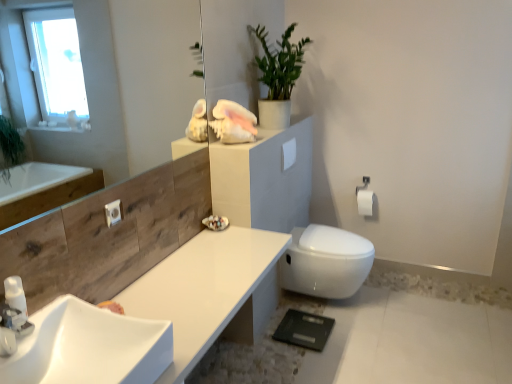
What is the approximate width of white glossy sink at lower left?

white glossy sink at lower left is 16.30 inches in width.

Image resolution: width=512 pixels, height=384 pixels. What do you see at coordinates (89, 347) in the screenshot?
I see `white glossy sink at lower left` at bounding box center [89, 347].

The image size is (512, 384). Find the location of `white matte toilet paper at upper right, which is the second toilet paper from back to front`. white matte toilet paper at upper right, which is the second toilet paper from back to front is located at coordinates (289, 153).

Considering the relative sizes of white glossy bidet at lower right and transparent glass mirror at upper left in the image provided, is white glossy bidet at lower right smaller than transparent glass mirror at upper left?

Incorrect, white glossy bidet at lower right is not smaller in size than transparent glass mirror at upper left.

Between point (320, 244) and point (169, 57), which one is positioned behind?

The point (169, 57) is behind.

Which object is positioned more to the right, white glossy bidet at lower right or transparent glass mirror at upper left?

Positioned to the right is white glossy bidet at lower right.

Between white glossy bidet at lower right and transparent glass mirror at upper left, which one has less height?

white glossy bidet at lower right is shorter.

Between white glossy soap dispenser at lower left and white glossy sink at lower left, which one has smaller width?

white glossy soap dispenser at lower left.

From the image's perspective, which is above, white glossy soap dispenser at lower left or white glossy sink at lower left?

white glossy soap dispenser at lower left, from the image's perspective.

Is white glossy soap dispenser at lower left not near white glossy sink at lower left?

That's not correct — white glossy soap dispenser at lower left is a little close to white glossy sink at lower left.

Is white glossy soap dispenser at lower left to the left of white glossy sink at lower left from the viewer's perspective?

Yes, white glossy soap dispenser at lower left is to the left of white glossy sink at lower left.

From a real-world perspective, who is located lower, green matte plant at upper center or white glossy sink at lower left?

white glossy sink at lower left, from a real-world perspective.

Can you confirm if green matte plant at upper center is smaller than white glossy sink at lower left?

No, green matte plant at upper center is not smaller than white glossy sink at lower left.

Is white glossy sink at lower left at the back of green matte plant at upper center?

No, white glossy sink at lower left is not at the back of green matte plant at upper center.

Can white glossy sink at lower left be found inside green matte plant at upper center?

No, white glossy sink at lower left is not surrounded by green matte plant at upper center.

From a real-world perspective, who is located lower, white glossy counter top at center or white glossy tap at lower left?

white glossy counter top at center.

Is white glossy counter top at center placed right next to white glossy tap at lower left?

No, white glossy counter top at center is not making contact with white glossy tap at lower left.

Considering the sizes of objects white glossy counter top at center and white glossy tap at lower left in the image provided, who is wider, white glossy counter top at center or white glossy tap at lower left?

Wider between the two is white glossy counter top at center.

From the image's perspective, who appears lower, white glossy counter top at center or white glossy tap at lower left?

white glossy counter top at center is shown below in the image.

Is white matte toilet paper at right, which is the 2th toilet paper from front to back, completely or partially outside of white glossy soap dispenser at lower left?

Yes.

Between white matte toilet paper at right, marked as the 1th toilet paper in a right-to-left arrangement, and white glossy soap dispenser at lower left, which one has smaller width?

Thinner between the two is white glossy soap dispenser at lower left.

From the image's perspective, between white matte toilet paper at right, marked as the 1th toilet paper in a right-to-left arrangement, and white glossy soap dispenser at lower left, which one is located above?

From the image's view, white matte toilet paper at right, marked as the 1th toilet paper in a right-to-left arrangement, is above.

Is white glossy tap at lower left at the back of white glossy soap dispenser at lower left?

white glossy soap dispenser at lower left does not have its back to white glossy tap at lower left.

Which is nearer, [21,299] or [19,320]?

The point [19,320] is closer.

Is there a large distance between white glossy soap dispenser at lower left and white glossy tap at lower left?

They are positioned close to each other.

Considering the sizes of white glossy soap dispenser at lower left and white glossy tap at lower left in the image, is white glossy soap dispenser at lower left bigger or smaller than white glossy tap at lower left?

In the image, white glossy soap dispenser at lower left appears to be smaller than white glossy tap at lower left.

Is white glossy sink at lower left surrounded by transparent glass mirror at upper left?

That's incorrect, white glossy sink at lower left is not inside transparent glass mirror at upper left.

Which object is further away from the camera taking this photo, transparent glass mirror at upper left or white glossy sink at lower left?

transparent glass mirror at upper left is further away from the camera.

Is transparent glass mirror at upper left to the left of white glossy sink at lower left from the viewer's perspective?

Incorrect, transparent glass mirror at upper left is not on the left side of white glossy sink at lower left.

Is transparent glass mirror at upper left oriented towards white glossy sink at lower left?

No, transparent glass mirror at upper left is not turned towards white glossy sink at lower left.

At what (x,y) coordinates should I click in order to perform the action: click on mirror that appears in front of the white glossy bidet at lower right. Please return your answer as a coordinate pair (x, y). The height and width of the screenshot is (384, 512). Looking at the image, I should click on (116, 84).

The height and width of the screenshot is (384, 512). In order to click on soap dispenser above the white glossy sink at lower left (from the image's perspective) in this screenshot , I will do `click(15, 294)`.

Based on their spatial positions, is white glossy soap dispenser at lower left or white matte toilet paper at right, the second toilet paper positioned from the left, further from green matte plant at upper center?

The object further to green matte plant at upper center is white glossy soap dispenser at lower left.

From the image, which object appears to be nearer to white matte toilet paper at upper right, placed as the first toilet paper when sorted from front to back, white glossy soap dispenser at lower left or white glossy sink at lower left?

Among the two, white glossy sink at lower left is located nearer to white matte toilet paper at upper right, placed as the first toilet paper when sorted from front to back.

Looking at this image, looking at the image, which one is located further to white glossy soap dispenser at lower left, white matte toilet paper at right, the 2th toilet paper from the top, or white matte toilet paper at upper right, the first toilet paper when ordered from top to bottom?

white matte toilet paper at right, the 2th toilet paper from the top, is further to white glossy soap dispenser at lower left.

Looking at the image, which one is located closer to white matte toilet paper at upper right, placed as the first toilet paper when sorted from front to back, white glossy counter top at center or white glossy bidet at lower right?

Among the two, white glossy bidet at lower right is located nearer to white matte toilet paper at upper right, placed as the first toilet paper when sorted from front to back.

In the scene shown: Based on their spatial positions, is white glossy sink at lower left or white glossy tap at lower left further from green matte plant at upper center?

white glossy tap at lower left lies further to green matte plant at upper center than the other object.

Looking at the image, which one is located further to white matte toilet paper at upper right, which is the second toilet paper from back to front, white glossy bidet at lower right or white glossy soap dispenser at lower left?

The object further to white matte toilet paper at upper right, which is the second toilet paper from back to front, is white glossy soap dispenser at lower left.

Considering their positions, is white glossy bidet at lower right positioned further to white matte toilet paper at upper right, which appears as the second toilet paper when viewed from the right, than white glossy sink at lower left?

white glossy sink at lower left lies further to white matte toilet paper at upper right, which appears as the second toilet paper when viewed from the right, than the other object.

From the image, which object appears to be farther from white glossy sink at lower left, white glossy tap at lower left or white glossy bidet at lower right?

white glossy bidet at lower right is further to white glossy sink at lower left.

The height and width of the screenshot is (384, 512). Identify the location of toilet paper between white glossy tap at lower left and white matte toilet paper at right, which is the 2th toilet paper from front to back, along the z-axis. (289, 153).

The width and height of the screenshot is (512, 384). What are the coordinates of `mirror between white glossy sink at lower left and white matte toilet paper at upper right, which is counted as the 2th toilet paper, starting from the bottom, in the front-back direction` in the screenshot? It's located at (116, 84).

Image resolution: width=512 pixels, height=384 pixels. I want to click on toilet paper positioned between white glossy sink at lower left and white matte toilet paper at right, marked as the 1th toilet paper in a right-to-left arrangement, from near to far, so click(289, 153).

This screenshot has width=512, height=384. I want to click on plant located between white glossy counter top at center and white matte toilet paper at right, the second toilet paper positioned from the left, in the depth direction, so click(x=279, y=62).